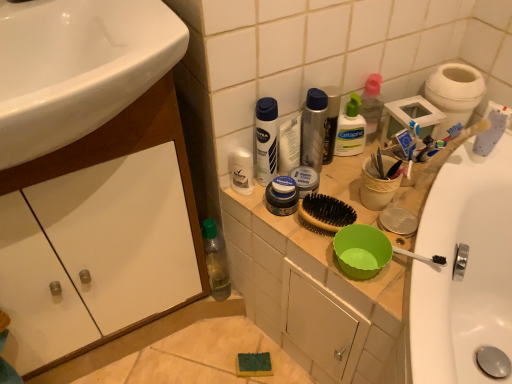
The image size is (512, 384). Identify the location of free space in front of translucent plastic mouthwash at center, which is the 2th mouthwash from left to right. (333, 198).